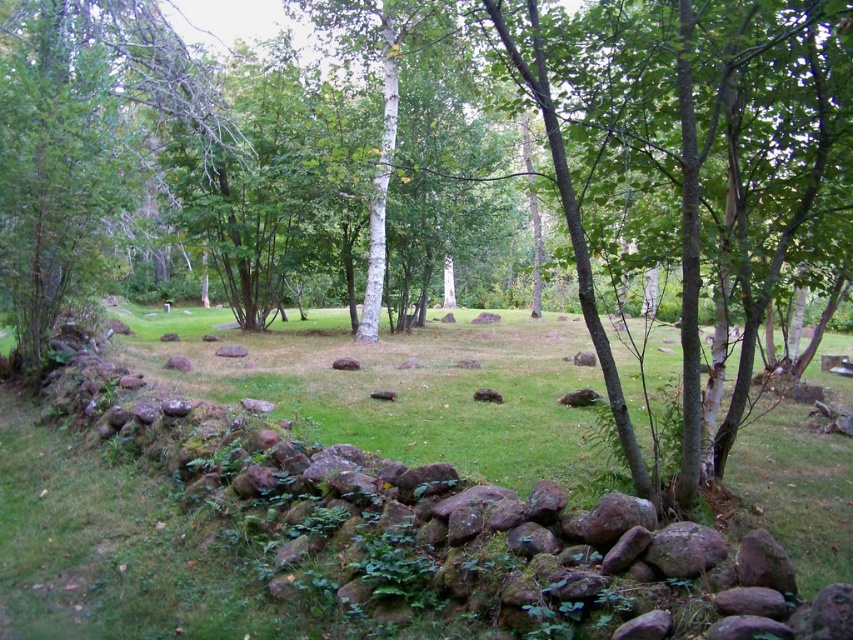
What do you see at coordinates (396, 390) in the screenshot? This screenshot has width=853, height=640. I see `rocky wall at lower left` at bounding box center [396, 390].

Is point (817, 520) more distant than point (526, 68)?

Yes.

Between point (498, 476) and point (625, 436), which one is positioned in front?

Point (625, 436)

Where is `rocky wall at lower left`? This screenshot has width=853, height=640. rocky wall at lower left is located at coordinates (396, 390).

Does green leafy tree at center appear on the left side of smooth bark tree at center?

Indeed, green leafy tree at center is positioned on the left side of smooth bark tree at center.

Between point (105, 282) and point (534, 44), which one is positioned behind?

The point (105, 282) is more distant.

In order to click on green leafy tree at center in this screenshot , I will do [x=82, y=141].

Where is `green leafy tree at center`? This screenshot has width=853, height=640. green leafy tree at center is located at coordinates (82, 141).

Which is more to the right, rocky wall at lower left or green leafy tree at center?

From the viewer's perspective, rocky wall at lower left appears more on the right side.

Does point (413, 445) lie in front of point (32, 298)?

That is True.

What do you see at coordinates (396, 390) in the screenshot? This screenshot has width=853, height=640. I see `rocky wall at lower left` at bounding box center [396, 390].

Identify the location of rocky wall at lower left. The image size is (853, 640). (396, 390).